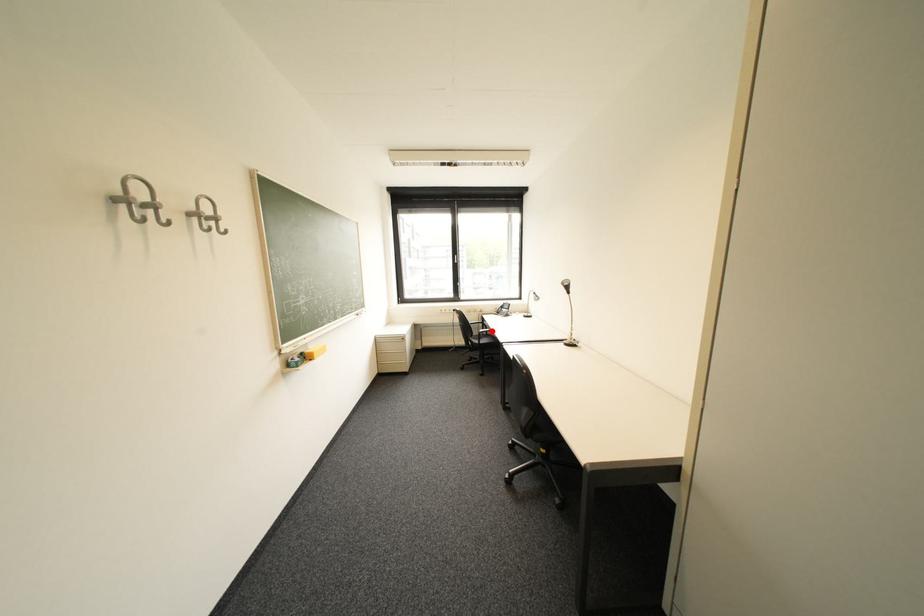
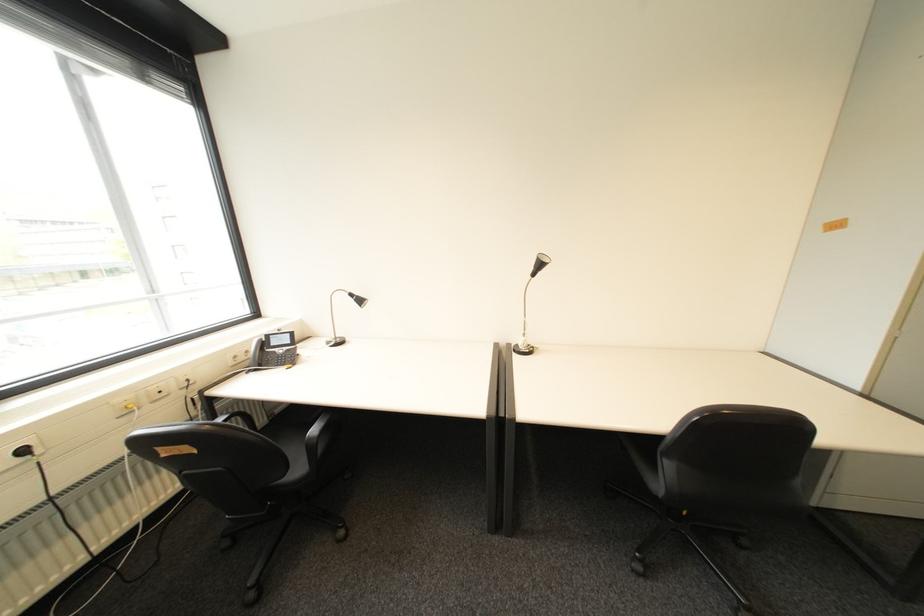
Question: I am providing you with two images of the same scene from different viewpoints. A red point is marked on the first image. At the location where the point appears in image 1, is it still visible in image 2?

Choices:
 (A) Yes
 (B) No

Answer: (B)